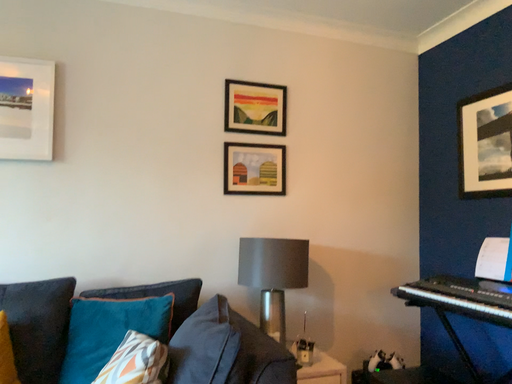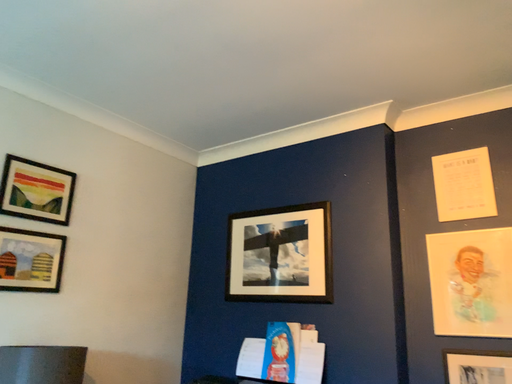
Question: How did the camera likely rotate when shooting the video?

Choices:
 (A) rotated right
 (B) rotated left

Answer: (A)